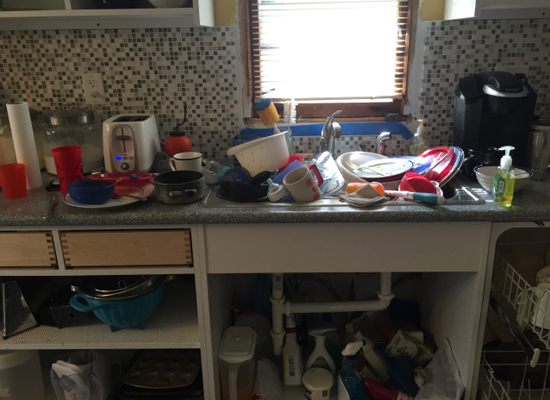
Where is `window frame`? window frame is located at coordinates (317, 105), (412, 20), (249, 37).